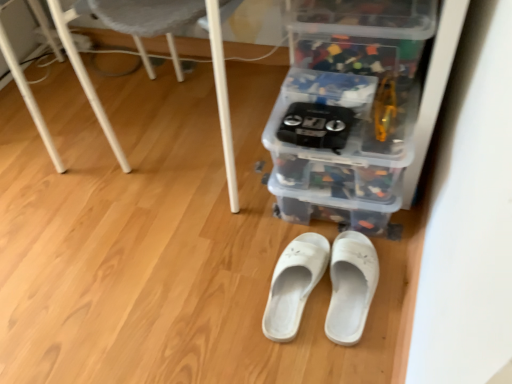
In order to click on vacant space in front of white fabric slipper at center, the 2th footwear positioned from the left in this screenshot , I will do `click(348, 351)`.